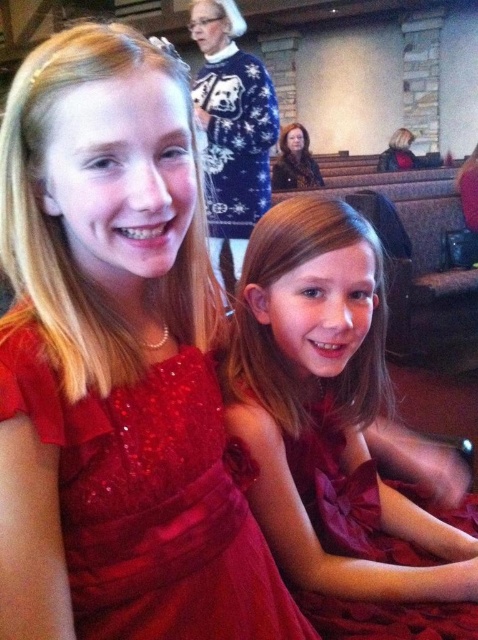
You are standing in front of the two girls in the image and want to take a photo of them. You need to position yourself exactly 1 meter away from the point marked at coordinates point (380, 248) to ensure the best lighting. Can you position yourself at that exact distance?

The distance of point (380, 248) from the camera is 91.92 centimeters, so positioning yourself exactly 1 meter away would require moving slightly closer since the current distance is 91.92 centimeters.

Both girls are wearing red dresses. The one on the left is wearing a satin red dress at center and the one on the right is wearing a shiny red dress at center. If they want to sit side by side on a pew that can only accommodate one dress width, which girl should move to make space?

The satin red dress at center is wider than the shiny red dress at center, so the girl wearing the satin red dress at center should move to make space.

You are a photographer who wants to focus on the shiny red dress at center. Based on the scene description, where should you aim your camera to capture the dress in the frame?

The shiny red dress at center is located at the 2D coordinates point (x=150, y=500), so you should aim your camera towards that position to capture it in the frame.